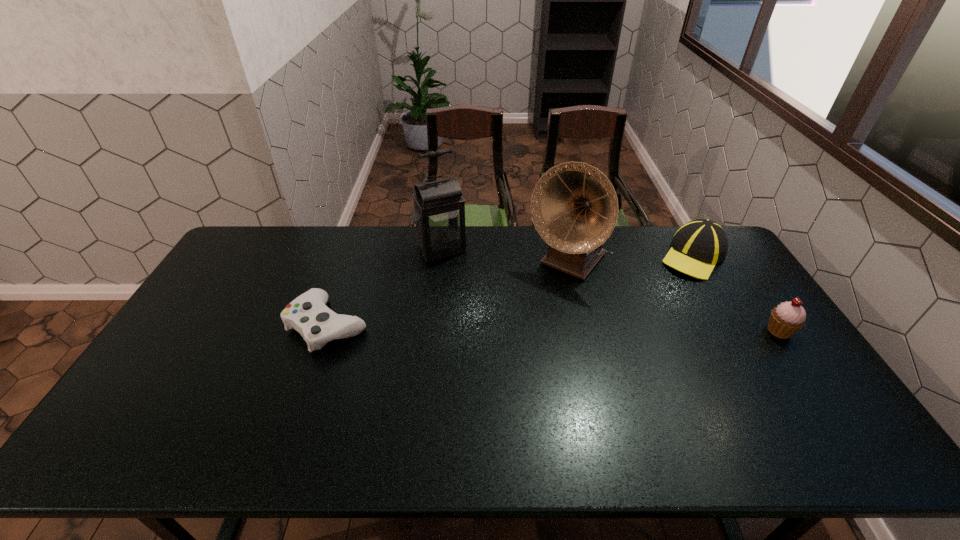
This screenshot has height=540, width=960. I want to click on vacant space that satisfies the following two spatial constraints: 1. on the front side of the shortest object; 2. on the left side of the cupcake, so click(x=326, y=331).

This screenshot has height=540, width=960. I want to click on vacant space that satisfies the following two spatial constraints: 1. on the front side of the third object from right to left; 2. on the left side of the cupcake, so click(584, 331).

What are the coordinates of `vacant area in the image that satisfies the following two spatial constraints: 1. on the front side of the third object from left to right; 2. on the right side of the cupcake` in the screenshot? It's located at (584, 331).